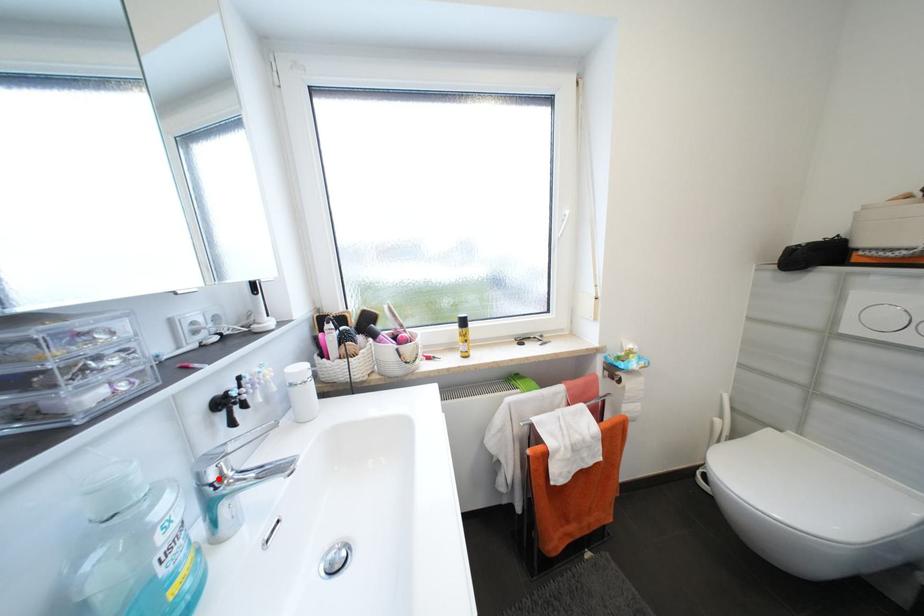
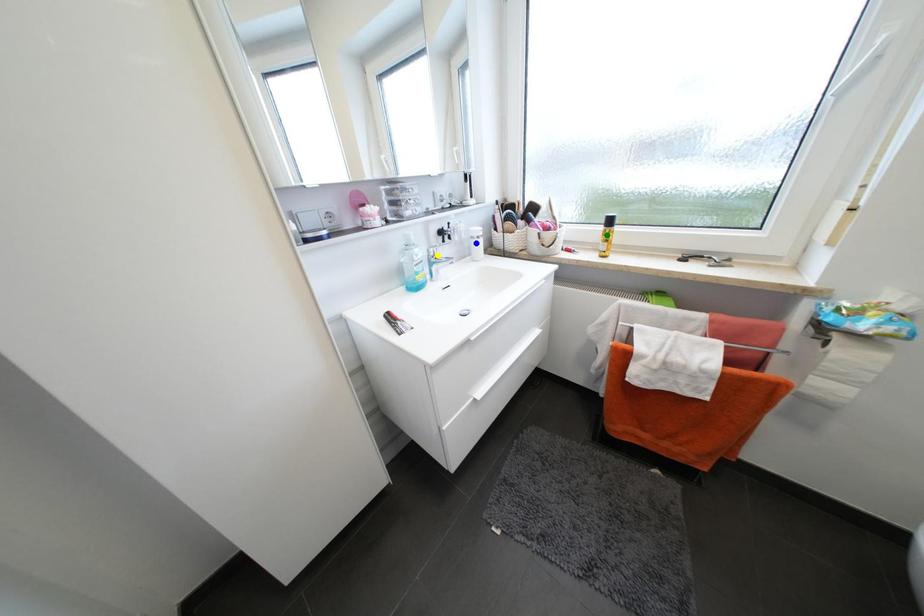
Question: I am providing you with two images of the same scene from different viewpoints. A red point is marked on the first image. You are given multiple points on the second image. Can you choose the point in image 2 that corresponds to the point in image 1?

Choices:
 (A) blue point
 (B) yellow point
 (C) green point

Answer: (B)